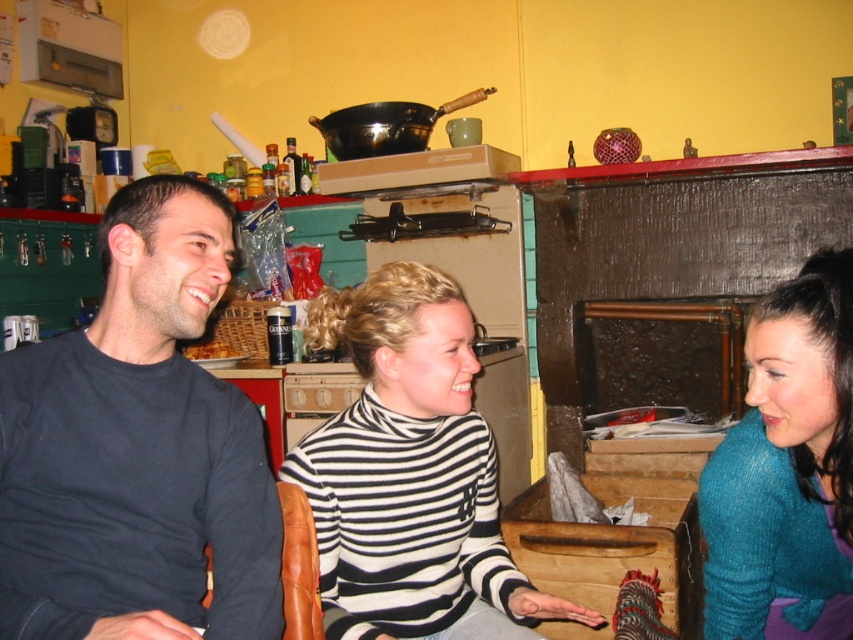
Is black cotton shirt at left below brown crumbly bread at left?

Indeed, black cotton shirt at left is positioned under brown crumbly bread at left.

Does black cotton shirt at left have a greater height compared to brown crumbly bread at left?

Yes, black cotton shirt at left is taller than brown crumbly bread at left.

Where is `black cotton shirt at left`? black cotton shirt at left is located at coordinates (137, 449).

Where is `black cotton shirt at left`? This screenshot has height=640, width=853. black cotton shirt at left is located at coordinates (137, 449).

Between black and white striped sweater at center and teal sweater at right, which one has more height?

With more height is black and white striped sweater at center.

Between black and white striped sweater at center and teal sweater at right, which one appears on the left side from the viewer's perspective?

Positioned to the left is black and white striped sweater at center.

Which is behind, point (456, 396) or point (698, 493)?

The point (698, 493) is more distant.

Locate an element on the screen. The height and width of the screenshot is (640, 853). black and white striped sweater at center is located at coordinates (410, 474).

Is black cotton shirt at left bigger than black and white striped sweater at center?

Actually, black cotton shirt at left might be smaller than black and white striped sweater at center.

Between black cotton shirt at left and black and white striped sweater at center, which one appears on the right side from the viewer's perspective?

Positioned to the right is black and white striped sweater at center.

Locate an element on the screen. The image size is (853, 640). black cotton shirt at left is located at coordinates (137, 449).